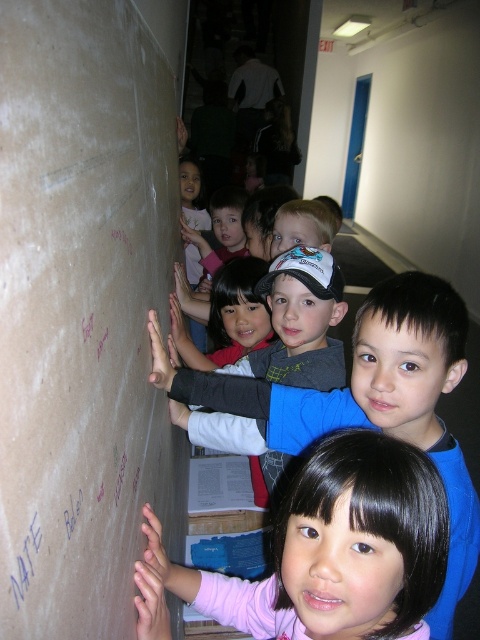
Question: Can you confirm if matte cardboard bulletin board at left is positioned below blue paper at upper left?

Choices:
 (A) yes
 (B) no

Answer: (B)

Question: Does pink fabric shirt at lower center appear on the right side of blue paper at upper left?

Choices:
 (A) yes
 (B) no

Answer: (A)

Question: Which object appears farthest from the camera in this image?

Choices:
 (A) matte cardboard bulletin board at left
 (B) blue paper at upper left

Answer: (B)

Question: Which point is farther from the camera taking this photo?

Choices:
 (A) (439, 560)
 (B) (40, 531)
 (C) (62, 260)

Answer: (A)

Question: Which point appears closest to the camera in this image?

Choices:
 (A) (57, 372)
 (B) (35, 554)

Answer: (B)

Question: Is pink fabric shirt at lower center thinner than blue paper at upper left?

Choices:
 (A) yes
 (B) no

Answer: (B)